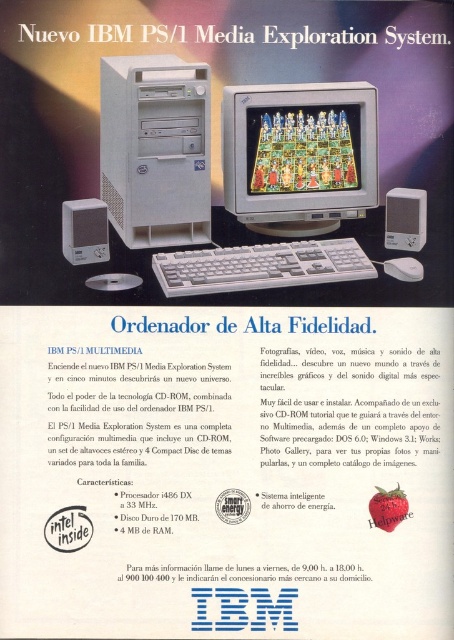
Is point (315, 264) less distant than point (404, 262)?

No, it is not.

Can you confirm if white plastic keyboard at center is taller than white plastic mouse at lower right?

Correct, white plastic keyboard at center is much taller as white plastic mouse at lower right.

This screenshot has height=640, width=454. What do you see at coordinates (261, 266) in the screenshot?
I see `white plastic keyboard at center` at bounding box center [261, 266].

Image resolution: width=454 pixels, height=640 pixels. Find the location of `white plastic keyboard at center`. white plastic keyboard at center is located at coordinates (261, 266).

Does matte plastic monitor at center have a greater height compared to white plastic computer tower at center-left?

No, matte plastic monitor at center is not taller than white plastic computer tower at center-left.

The height and width of the screenshot is (640, 454). Describe the element at coordinates (299, 156) in the screenshot. I see `matte plastic monitor at center` at that location.

What do you see at coordinates (299, 156) in the screenshot? This screenshot has height=640, width=454. I see `matte plastic monitor at center` at bounding box center [299, 156].

Locate an element on the screen. This screenshot has width=454, height=640. matte plastic monitor at center is located at coordinates (299, 156).

Who is positioned more to the left, white plastic computer tower at center-left or white plastic keyboard at center?

Positioned to the left is white plastic computer tower at center-left.

Is point (182, 243) behind point (167, 282)?

Yes, point (182, 243) is farther from viewer.

Describe the element at coordinates (156, 148) in the screenshot. I see `white plastic computer tower at center-left` at that location.

The width and height of the screenshot is (454, 640). What are the coordinates of `white plastic computer tower at center-left` in the screenshot? It's located at (156, 148).